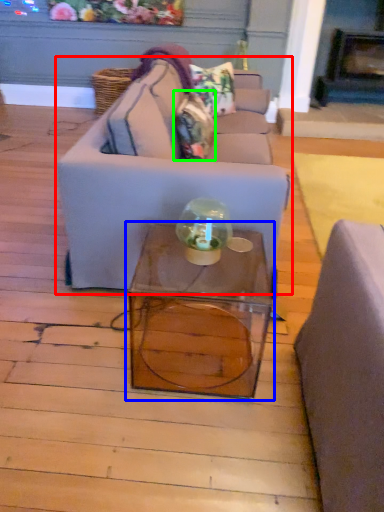
Question: Estimate the real-world distances between objects in this image. Which object is farther from studio couch (highlighted by a red box), table (highlighted by a blue box) or pillow (highlighted by a green box)?

Choices:
 (A) table
 (B) pillow

Answer: (B)